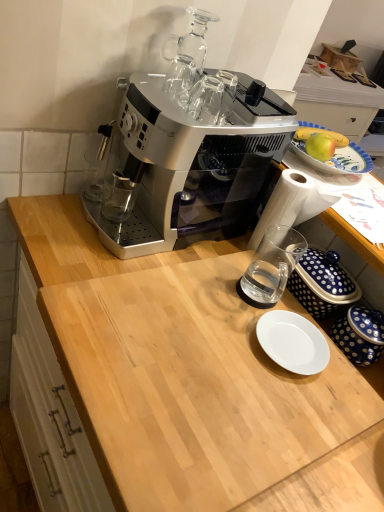
Question: Is blue dotted ceramic jar at lower right to the left of white glossy plate at center from the viewer's perspective?

Choices:
 (A) no
 (B) yes

Answer: (A)

Question: Are blue dotted ceramic jar at lower right and white glossy plate at center making contact?

Choices:
 (A) yes
 (B) no

Answer: (A)

Question: Can you confirm if blue dotted ceramic jar at lower right is shorter than white glossy plate at center?

Choices:
 (A) yes
 (B) no

Answer: (B)

Question: From the image's perspective, is blue dotted ceramic jar at lower right under white glossy plate at center?

Choices:
 (A) no
 (B) yes

Answer: (A)

Question: From a real-world perspective, is blue dotted ceramic jar at lower right over white glossy plate at center?

Choices:
 (A) yes
 (B) no

Answer: (A)

Question: Based on their sizes in the image, would you say transparent glass cups at upper center is bigger or smaller than light wood cutting board at center?

Choices:
 (A) big
 (B) small

Answer: (B)

Question: Looking at their shapes, would you say transparent glass cups at upper center is wider or thinner than light wood cutting board at center?

Choices:
 (A) wide
 (B) thin

Answer: (B)

Question: From the image's perspective, is transparent glass cups at upper center above or below light wood cutting board at center?

Choices:
 (A) below
 (B) above

Answer: (B)

Question: Considering their positions, is transparent glass cups at upper center located in front of or behind light wood cutting board at center?

Choices:
 (A) behind
 (B) front

Answer: (A)

Question: Considering the positions of point [x=332, y=140] and point [x=350, y=323], is point [x=332, y=140] closer or farther from the camera than point [x=350, y=323]?

Choices:
 (A) closer
 (B) farther

Answer: (B)

Question: Is green matte apple at upper right wider or thinner than blue dotted ceramic jar at lower right?

Choices:
 (A) thin
 (B) wide

Answer: (A)

Question: Is green matte apple at upper right inside or outside of blue dotted ceramic jar at lower right?

Choices:
 (A) outside
 (B) inside

Answer: (A)

Question: From the image's perspective, relative to blue dotted ceramic jar at lower right, is green matte apple at upper right above or below?

Choices:
 (A) above
 (B) below

Answer: (A)

Question: Is white glossy plate at center situated inside clear glass cup at center or outside?

Choices:
 (A) outside
 (B) inside

Answer: (A)

Question: From a real-world perspective, is white glossy plate at center physically located above or below clear glass cup at center?

Choices:
 (A) above
 (B) below

Answer: (B)